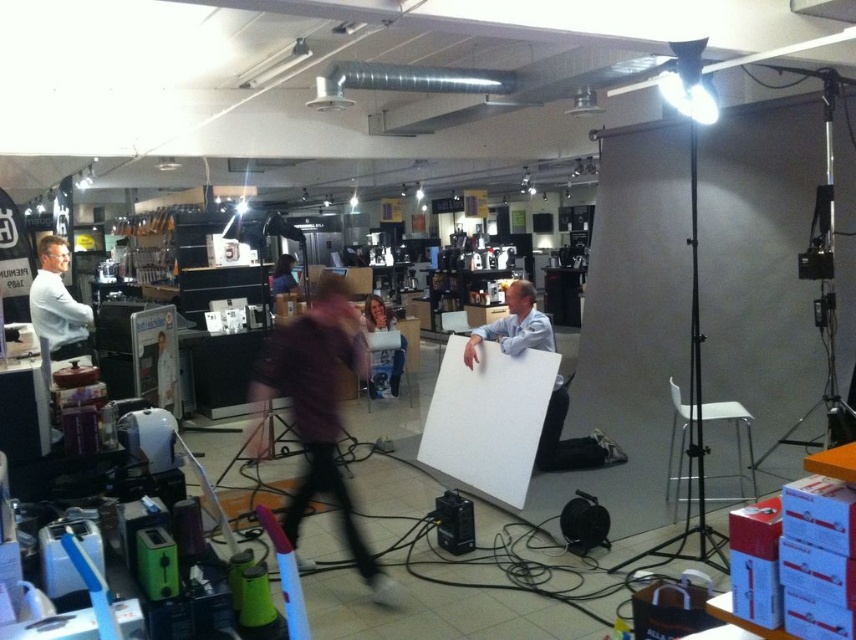
Which is above, purple fabric at center or white shirt at left?

white shirt at left is above.

Between point (384, 588) and point (84, 344), which one is positioned in front?

Point (384, 588) is more forward.

Find the location of a particular element. purple fabric at center is located at coordinates (317, 410).

Is white matte desk at center bigger than matte purple shirt at center?

Indeed, white matte desk at center has a larger size compared to matte purple shirt at center.

Who is taller, white matte desk at center or matte purple shirt at center?

white matte desk at center is taller.

Where is `white matte desk at center`? Image resolution: width=856 pixels, height=640 pixels. white matte desk at center is located at coordinates (569, 440).

Consider the image. Measure the distance between point (348, 500) and camera.

The distance of point (348, 500) from camera is 3.42 meters.

Can you confirm if purple fabric at center is wider than dark purple fabric at center?

Yes, purple fabric at center is wider than dark purple fabric at center.

This screenshot has height=640, width=856. Identify the location of purple fabric at center. (317, 410).